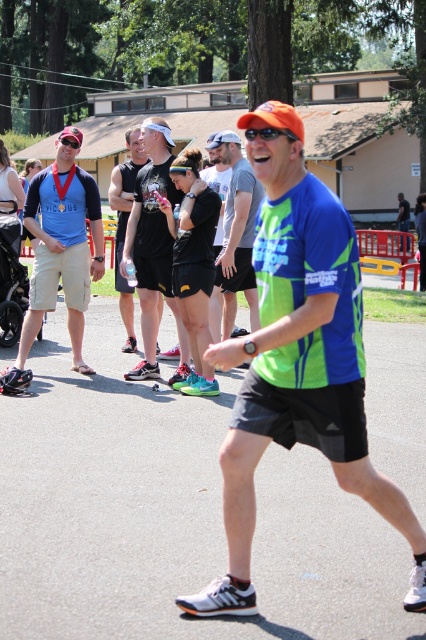
Question: Considering the real-world distances, which object is farthest from the black matte shorts at center?

Choices:
 (A) black athletic shorts at center
 (B) matte blue shirt at left
 (C) neon green jersey at center

Answer: (B)

Question: Which point is farther from the camera taking this photo?

Choices:
 (A) (172, 380)
 (B) (279, 364)

Answer: (A)

Question: Is black matte shorts at center below neon green jersey at center?

Choices:
 (A) yes
 (B) no

Answer: (A)

Question: Does matte blue shirt at left appear on the right side of black athletic shorts at center?

Choices:
 (A) yes
 (B) no

Answer: (B)

Question: Does neon green/reflective fabric shirt at center have a lesser width compared to matte blue shirt at left?

Choices:
 (A) yes
 (B) no

Answer: (B)

Question: Based on their relative distances, which object is nearer to the neon green/reflective fabric shirt at center?

Choices:
 (A) black athletic shorts at center
 (B) matte blue shirt at left
 (C) black matte shorts at center

Answer: (C)